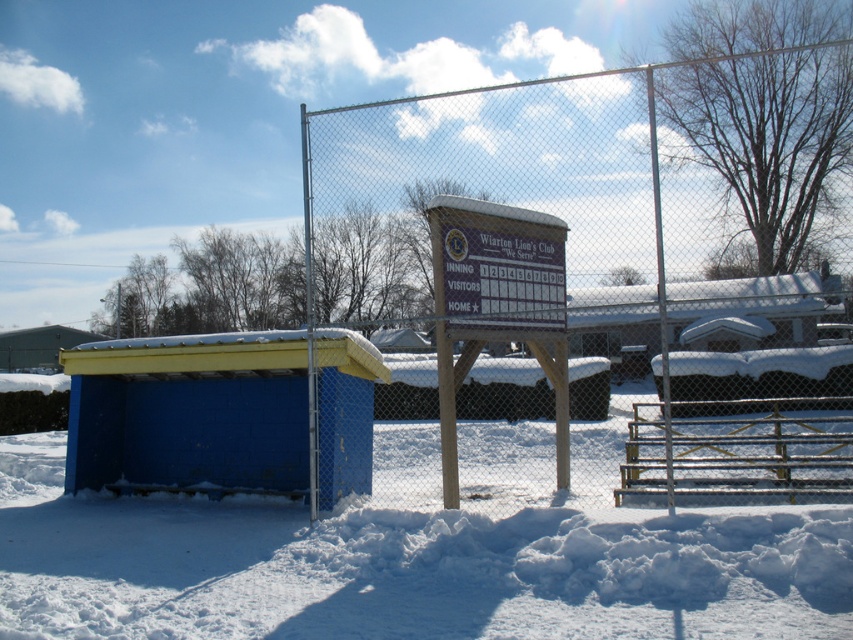
Question: Which point is farther to the camera?

Choices:
 (A) (44, 342)
 (B) (506, 212)
 (C) (334, 467)
 (D) (534, 595)

Answer: (A)

Question: Which point is farther from the camera taking this photo?

Choices:
 (A) (276, 372)
 (B) (44, 360)
 (C) (697, 269)
 (D) (560, 324)

Answer: (B)

Question: Where is blue painted wood shed at left located in relation to yellow plastic hut at lower left in the image?

Choices:
 (A) left
 (B) right

Answer: (B)

Question: Among these objects, which one is farthest from the camera?

Choices:
 (A) blue painted wood shed at left
 (B) wooden sign at center
 (C) metallic chain-link fence at center

Answer: (A)

Question: Observing the image, what is the correct spatial positioning of white fluffy snow at lower center in reference to yellow plastic hut at lower left?

Choices:
 (A) above
 (B) below

Answer: (B)

Question: Can you confirm if metallic chain-link fence at center is wider than white fluffy snow at lower center?

Choices:
 (A) yes
 (B) no

Answer: (A)